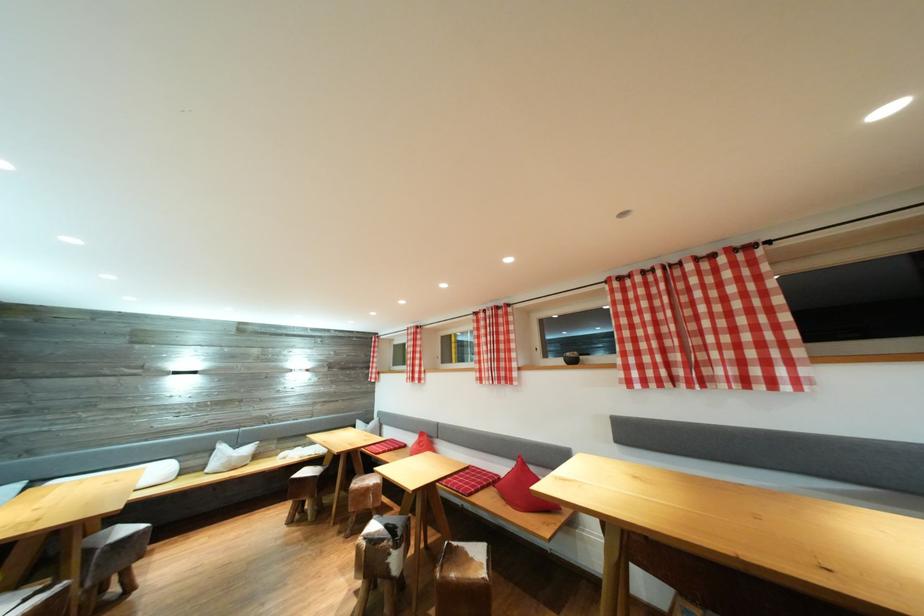
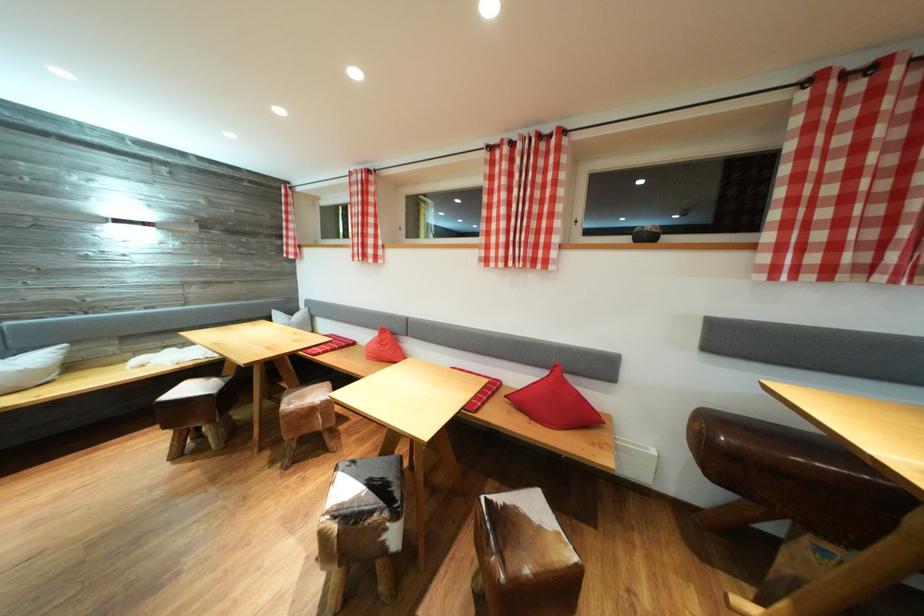
The point at (429, 440) is marked in the first image. Where is the corresponding point in the second image?

(390, 336)